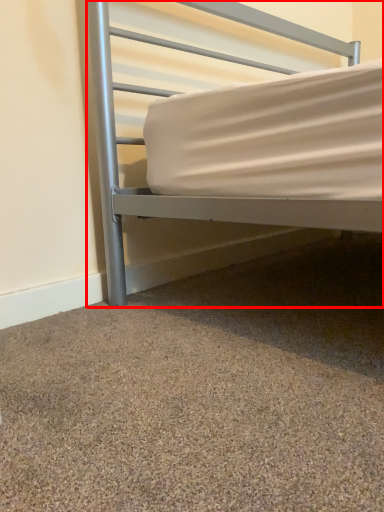
Question: Considering the relative positions of bed (annotated by the red box) and granite in the image provided, where is bed (annotated by the red box) located with respect to the staircase?

Choices:
 (A) left
 (B) right

Answer: (B)